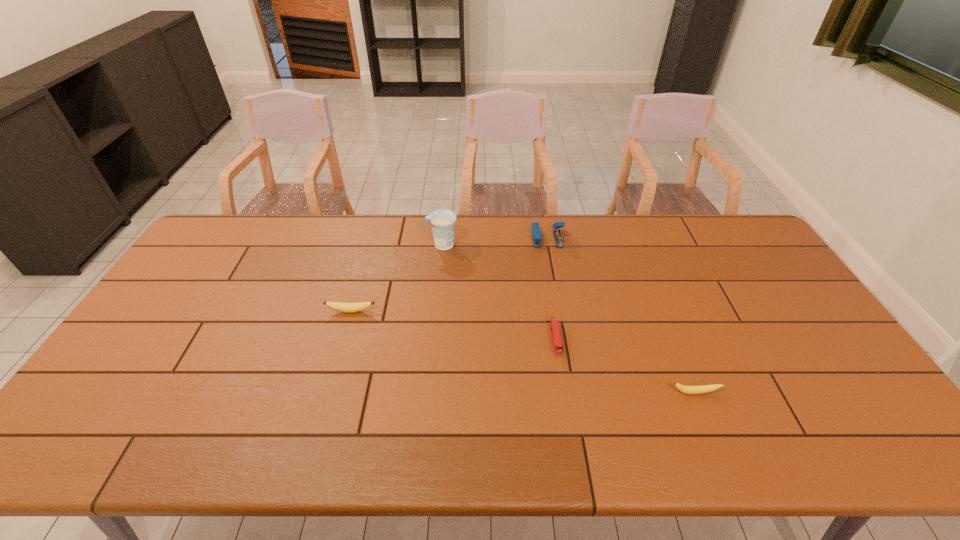
I want to click on free space located 0.190m on the right of the fourth object from right to left, so click(x=513, y=245).

You are a GUI agent. You are given a task and a screenshot of the screen. Output one action in this format:
    pyautogui.click(x=<x>, y=<y>)
    Task: Click on the free location located on the right of the second tallest object
    
    Given the screenshot: What is the action you would take?
    pyautogui.click(x=626, y=238)

At what (x,y) coordinates should I click in order to perform the action: click on vacant space situated on the front-facing side of the fourth farthest object. Please return your answer as a coordinate pair (x, y). This screenshot has width=960, height=540. Looking at the image, I should click on (561, 372).

Find the location of `vacant space located on the right of the farther banana`. vacant space located on the right of the farther banana is located at coordinates (509, 311).

Where is `free space located 0.150m on the upward curve of the nearest object`? This screenshot has height=540, width=960. free space located 0.150m on the upward curve of the nearest object is located at coordinates (720, 455).

Locate an element on the screen. yogurt present at the far edge is located at coordinates (442, 221).

Where is `stapler located at the far edge`? Image resolution: width=960 pixels, height=540 pixels. stapler located at the far edge is located at coordinates (536, 233).

Image resolution: width=960 pixels, height=540 pixels. Find the location of `vacant space at the far edge`. vacant space at the far edge is located at coordinates (493, 223).

The height and width of the screenshot is (540, 960). Find the location of `vacant region at the near edge of the desktop`. vacant region at the near edge of the desktop is located at coordinates (799, 433).

Find the location of a particular element. vacant region at the left edge is located at coordinates (108, 404).